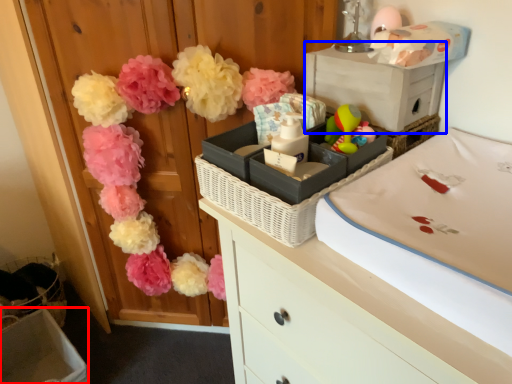
Question: Which of the following is the farthest to the observer, storage box (highlighted by a red box) or storage box (highlighted by a blue box)?

Choices:
 (A) storage box
 (B) storage box

Answer: (A)